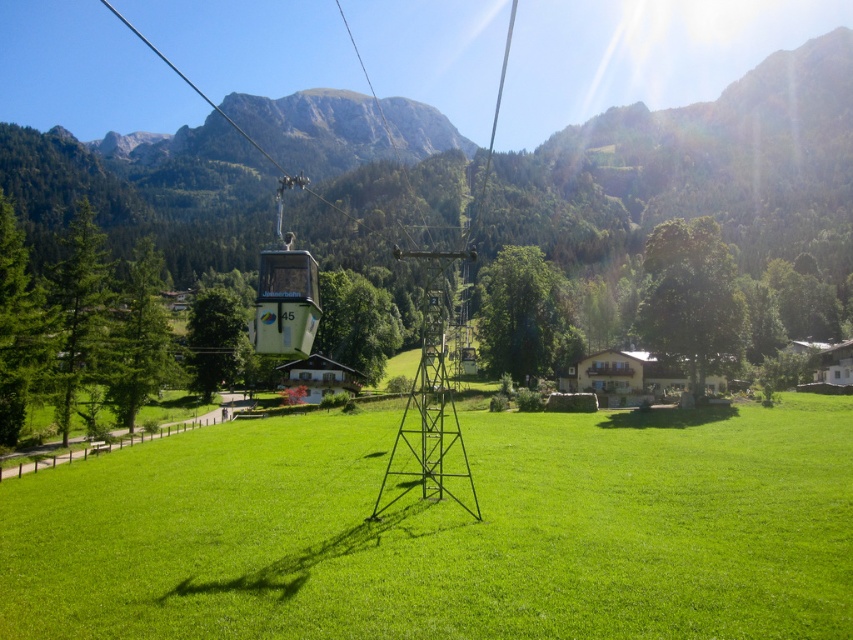
You are standing on the green grass at center and looking up. Can you see the green matte cable car at center above you?

Yes, the green grass at center is positioned under the green matte cable car at center, so you can see it above you.

You are a hiker standing on the green grass at center and looking towards the green matte cable car at center. Which object is taller from your perspective?

The green matte cable car at center is taller than the green grass at center.